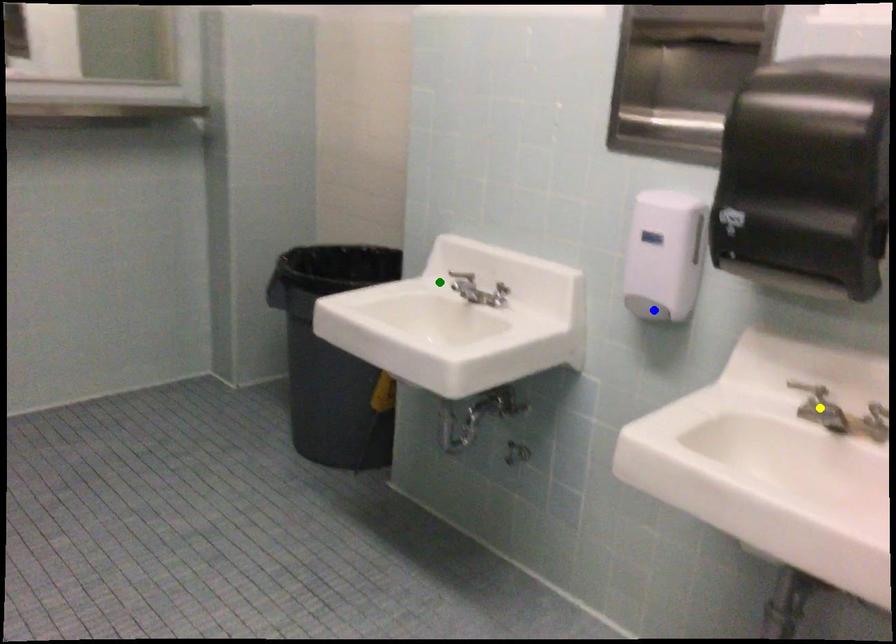
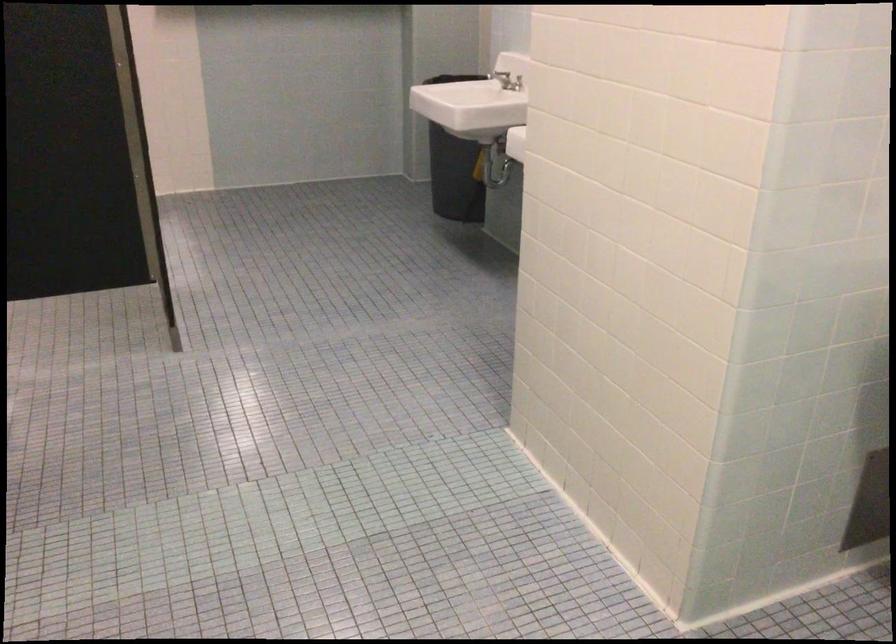
I am providing you with two images of the same scene from different viewpoints. Three points are marked in image1. Which point corresponds to a part or object that is occluded in image2?In image1, three points are marked. Which of them correspond to a part or object that is occluded in image2?Among the three points shown in image1, which one corresponds to a part or object that is no longer visible due to occlusion in image2?

yellow point, blue point